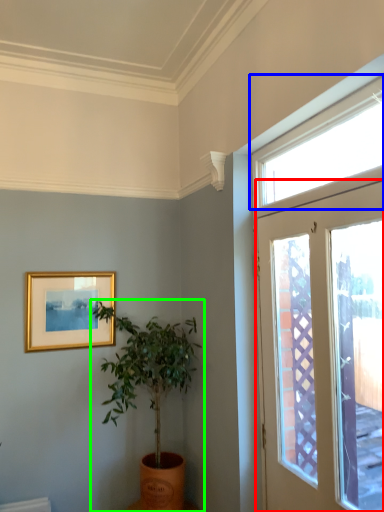
Question: Based on their relative distances, which object is nearer to door (highlighted by a red box)? Choose from window (highlighted by a blue box) and houseplant (highlighted by a green box).

Choices:
 (A) window
 (B) houseplant

Answer: (A)